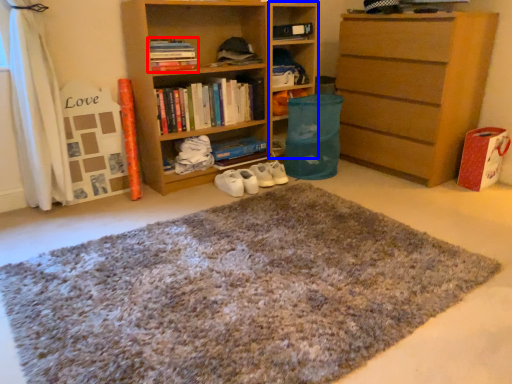
Question: Which object appears closest to the camera in this image, book (highlighted by a red box) or cabinet (highlighted by a blue box)?

Choices:
 (A) book
 (B) cabinet

Answer: (A)